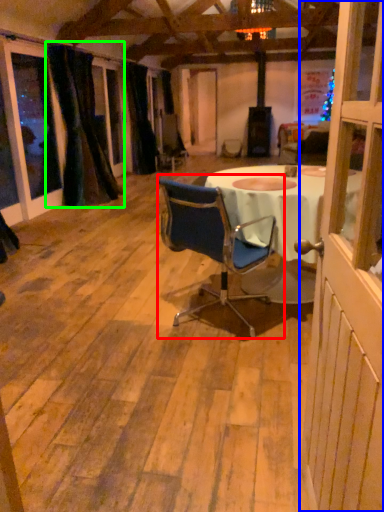
Question: Estimate the real-world distances between objects in this image. Which object is farther from chair (highlighted by a red box), screen door (highlighted by a blue box) or curtain (highlighted by a green box)?

Choices:
 (A) screen door
 (B) curtain

Answer: (B)